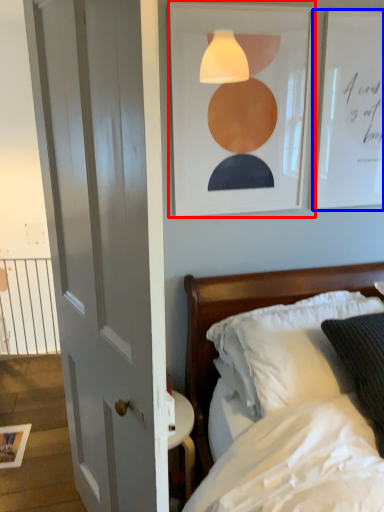
Question: Which of the following is the farthest to the observer, picture frame (highlighted by a red box) or picture frame (highlighted by a blue box)?

Choices:
 (A) picture frame
 (B) picture frame

Answer: (B)